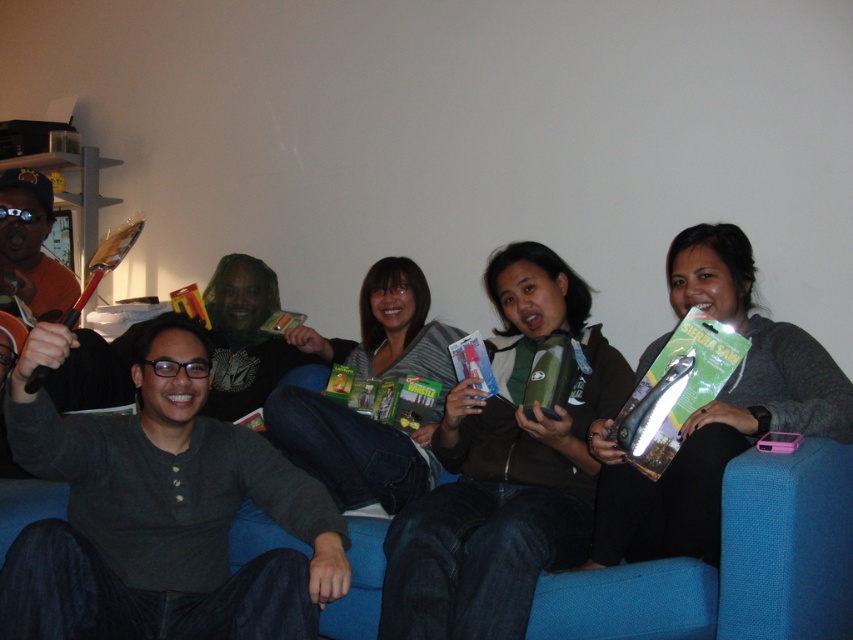
Question: Can you confirm if matte gray sweater at center is wider than clear plastic survival saw at center?

Choices:
 (A) yes
 (B) no

Answer: (A)

Question: Which point is farther from the camera taking this photo?

Choices:
 (A) (341, 432)
 (B) (679, 410)
 (C) (608, 481)

Answer: (A)

Question: Is green matte water bottle at center smaller than matte gray sweater at center?

Choices:
 (A) no
 (B) yes

Answer: (A)

Question: Which object is closer to the camera taking this photo?

Choices:
 (A) matte green box at center
 (B) matte gray sweater at center
 (C) green matte water bottle at center

Answer: (C)

Question: Is green matte water bottle at center further to the viewer compared to matte green box at center?

Choices:
 (A) yes
 (B) no

Answer: (B)

Question: Which point appears closest to the camera in this image?

Choices:
 (A) (717, 349)
 (B) (550, 256)
 (C) (409, 339)
 (D) (753, 348)

Answer: (A)